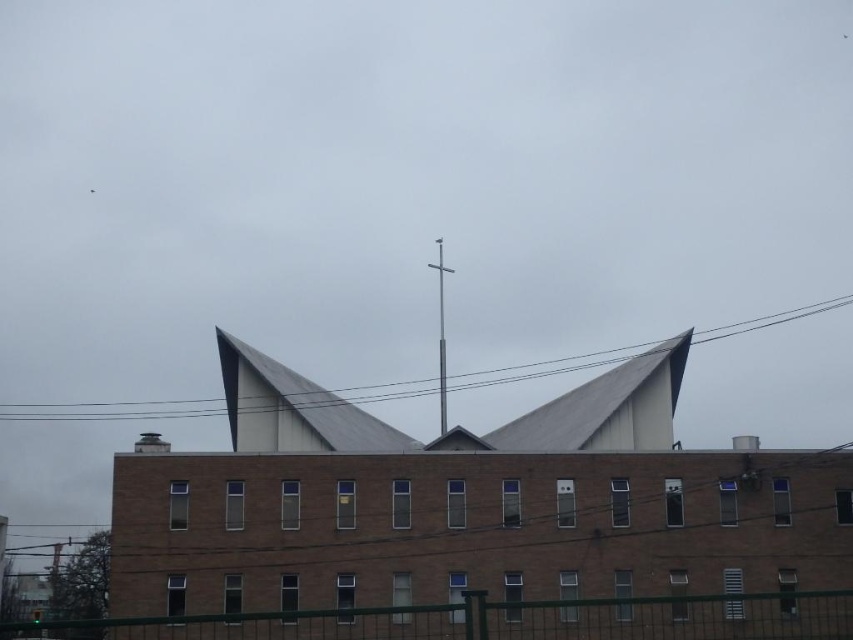
Who is positioned more to the left, black wire at upper center or silver metallic cross at center?

black wire at upper center

How distant is black wire at upper center from silver metallic cross at center?

They are 23.61 meters apart.

Locate an element on the screen. black wire at upper center is located at coordinates (113, 410).